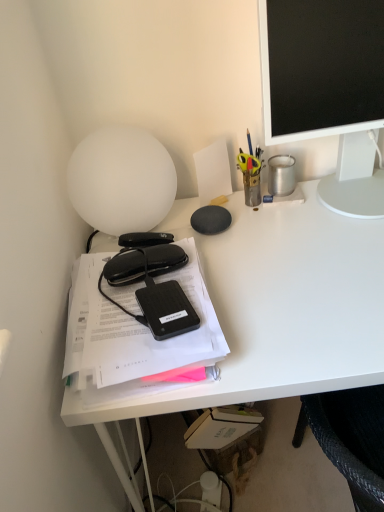
Where is `free space to the left of matte black monitor at upper right`? Image resolution: width=384 pixels, height=512 pixels. free space to the left of matte black monitor at upper right is located at coordinates (233, 234).